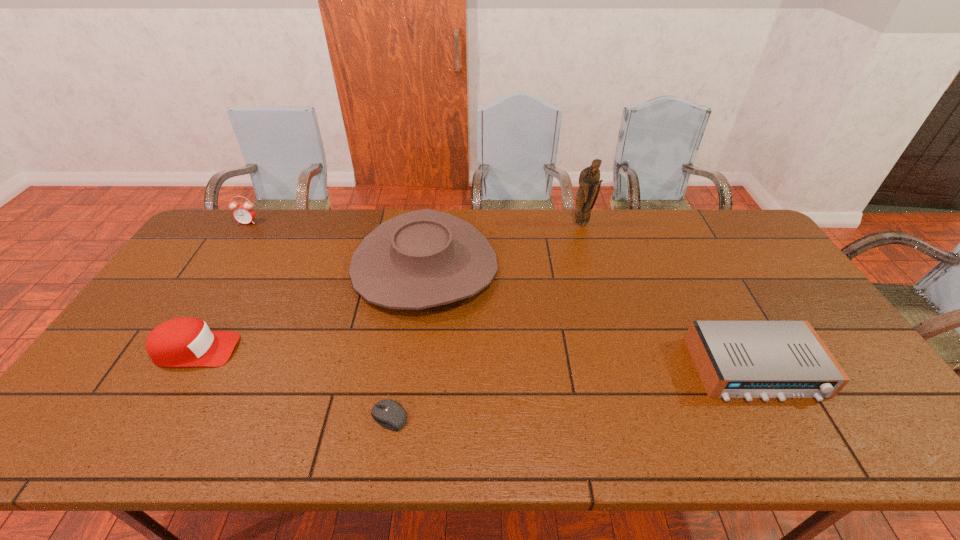
You are a GUI agent. You are given a task and a screenshot of the screen. Output one action in this format:
    pyautogui.click(x=<x>, y=<y>)
    Task: Click on the figurine
    The height and width of the screenshot is (540, 960).
    Given the screenshot: What is the action you would take?
    pyautogui.click(x=589, y=181)

At what (x,y) coordinates should I click in order to perform the action: click on the tallest object. Please return your answer as a coordinate pair (x, y). The width and height of the screenshot is (960, 540). Looking at the image, I should click on (589, 181).

Where is `cowboy hat`? cowboy hat is located at coordinates (421, 259).

The height and width of the screenshot is (540, 960). In order to click on alarm clock in this screenshot , I will do `click(244, 213)`.

At what (x,y) coordinates should I click in order to perform the action: click on the fourth tallest object. Please return your answer as a coordinate pair (x, y). The width and height of the screenshot is (960, 540). Looking at the image, I should click on (181, 342).

Identify the location of the rightmost object. (735, 359).

This screenshot has height=540, width=960. What are the coordinates of `the second shortest object` in the screenshot? It's located at (735, 359).

Identify the location of the shortest object. (389, 414).

Identify the location of vacant area situated 0.190m on the front-facing side of the second object from right to left. (592, 263).

Where is `free region located 0.140m on the right of the cowboy hat`? This screenshot has width=960, height=540. free region located 0.140m on the right of the cowboy hat is located at coordinates (541, 266).